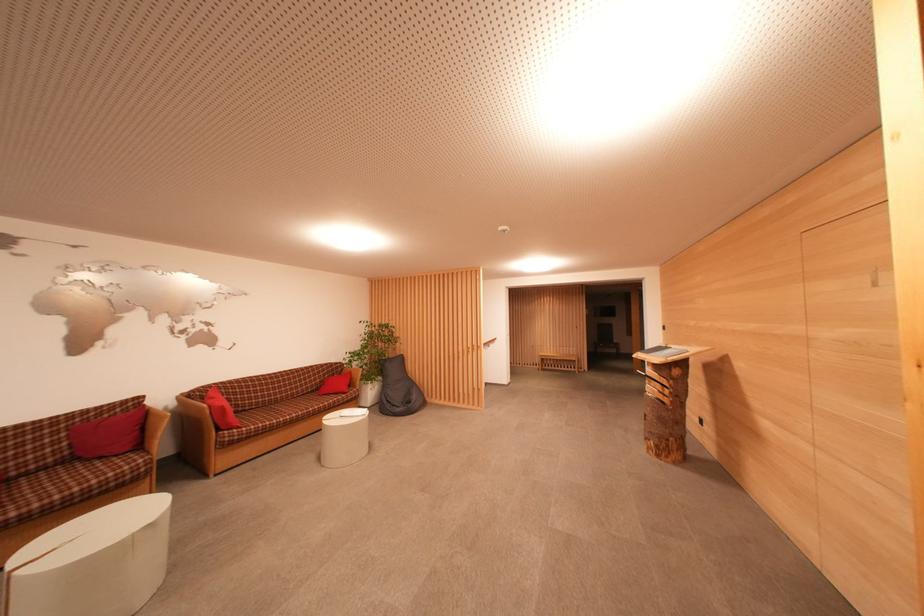
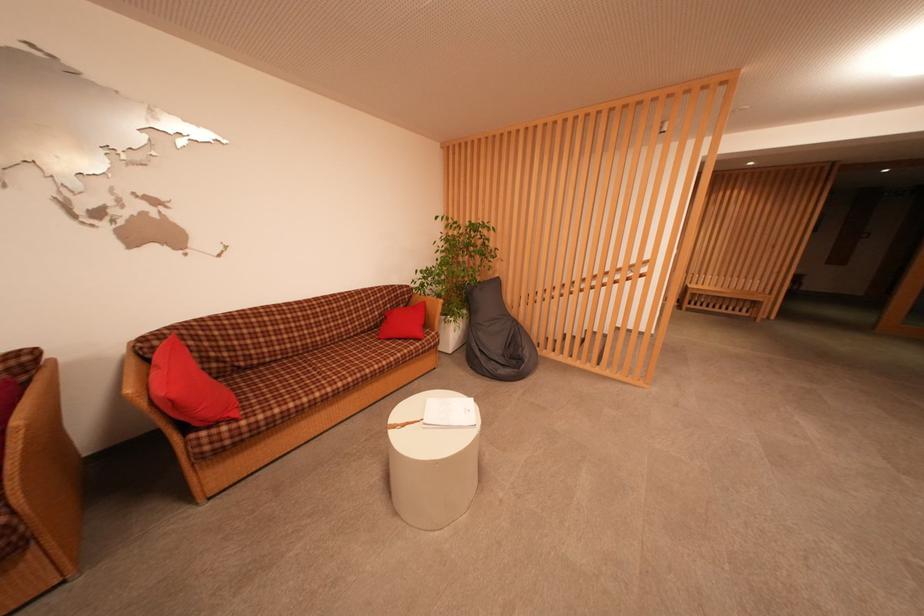
What movement of the cameraman would produce the second image?

The cameraman walked toward left, forward.